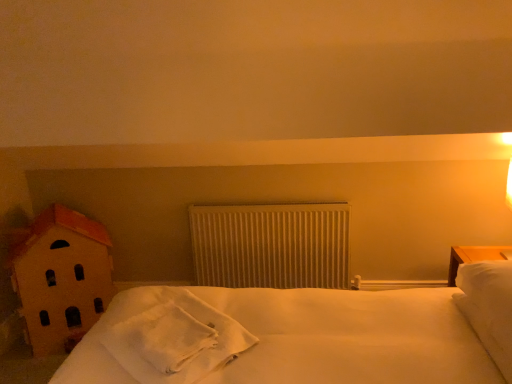
I want to click on free space above white textured radiator at center (from a real-world perspective), so click(x=273, y=206).